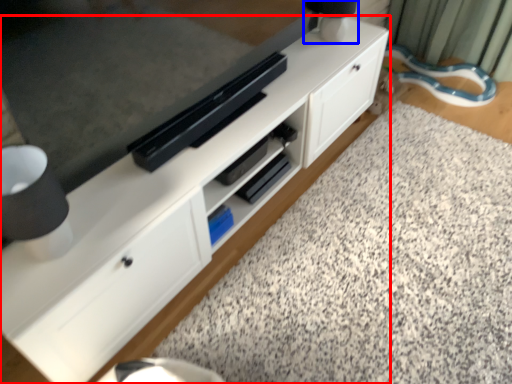
Question: Which point is closer to the camera, cabinetry (highlighted by a red box) or table lamp (highlighted by a blue box)?

Choices:
 (A) cabinetry
 (B) table lamp

Answer: (A)